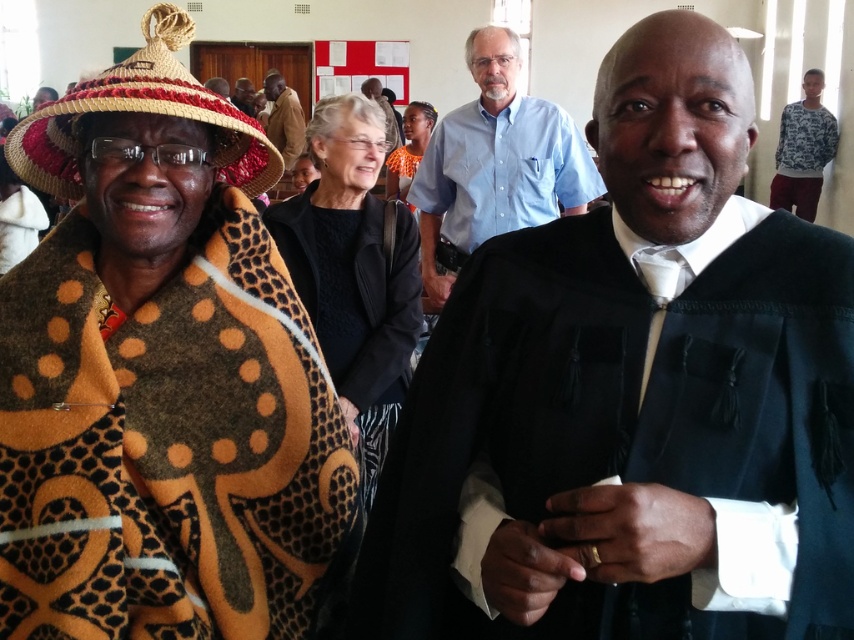
Is braided straw sombrero at upper left taller than white printed sweater at upper right?

Incorrect, braided straw sombrero at upper left's height is not larger of white printed sweater at upper right's.

Can you confirm if braided straw sombrero at upper left is positioned to the left of white printed sweater at upper right?

Yes, braided straw sombrero at upper left is to the left of white printed sweater at upper right.

Is point (186, 106) positioned behind point (811, 77)?

No, (186, 106) is in front of (811, 77).

Where is `braided straw sombrero at upper left`? braided straw sombrero at upper left is located at coordinates (142, 112).

Based on the photo, does brown textured blanket at left have a larger size compared to light blue shirt at center?

Incorrect, brown textured blanket at left is not larger than light blue shirt at center.

Between point (200, 376) and point (390, 136), which one is positioned in front?

Point (200, 376)

Find the location of a particular element. The image size is (854, 640). brown textured blanket at left is located at coordinates (168, 449).

Locate an element on the screen. brown textured blanket at left is located at coordinates (168, 449).

Based on the photo, between white printed sweater at upper right and brown leather jacket at center, which one is positioned higher?

Positioned higher is brown leather jacket at center.

Who is lower down, white printed sweater at upper right or brown leather jacket at center?

white printed sweater at upper right

This screenshot has width=854, height=640. In order to click on white printed sweater at upper right in this screenshot , I will do `click(803, 148)`.